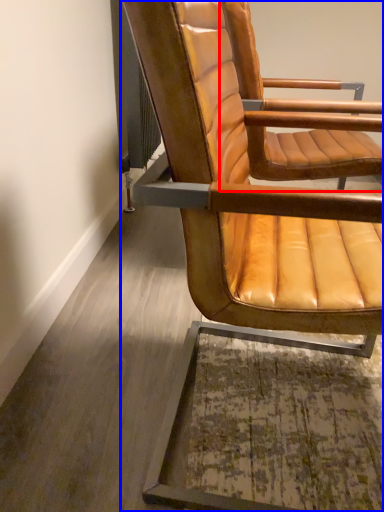
Question: Among these objects, which one is nearest to the camera, chair (highlighted by a red box) or chair (highlighted by a blue box)?

Choices:
 (A) chair
 (B) chair

Answer: (B)